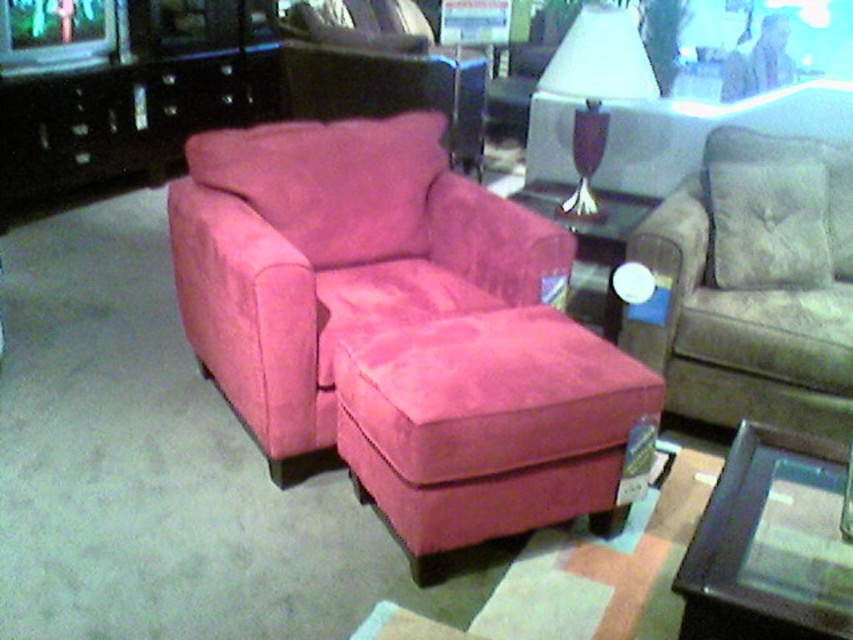
Based on the photo, you are a customer in a furniture store looking to buy an armchair. You see the suede pink armchair at center and the suede beige armchair at right. Which one is bigger?

The suede pink armchair at center is larger in size compared to the suede beige armchair at right.